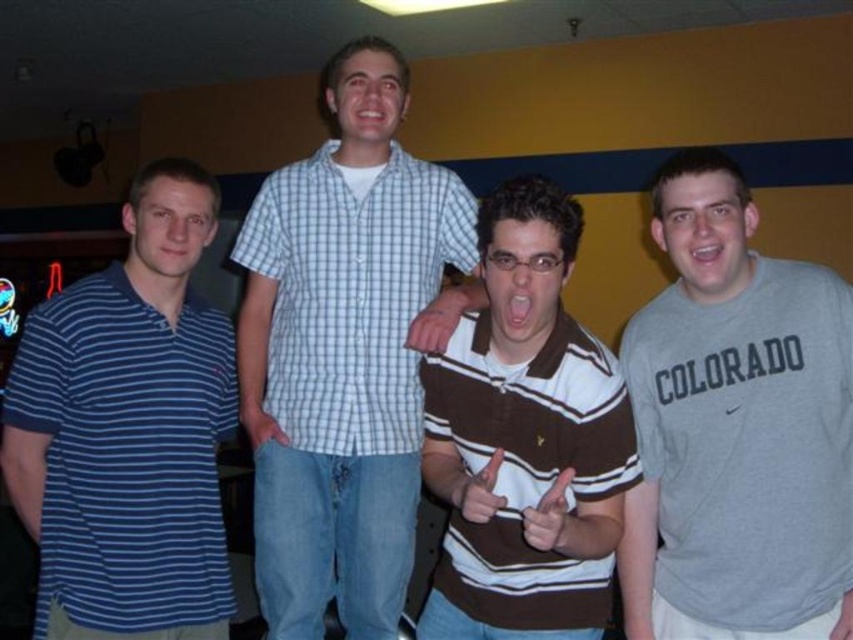
You are planning to take a photo of the white checkered shirt at center and the blue striped polo shirt at left. Which of these two shirts appears bigger in the photo?

The white checkered shirt at center appears bigger in the photo because it has a larger size compared to the blue striped polo shirt at left.

You are a photographer trying to capture a group photo of the white checkered shirt at center and the brown striped polo shirt at center. Since you want both subjects to appear equally sized in the photo, which one should you move closer to the camera?

The white checkered shirt at center is much taller than the brown striped polo shirt at center, so you should move the brown striped polo shirt at center closer to the camera to make them appear the same size.

You are standing in the room where the four men are posing. You want to find the white checkered shirt at center. Where would you look based on the coordinates provided?

The white checkered shirt at center is located at coordinates point [345,352].